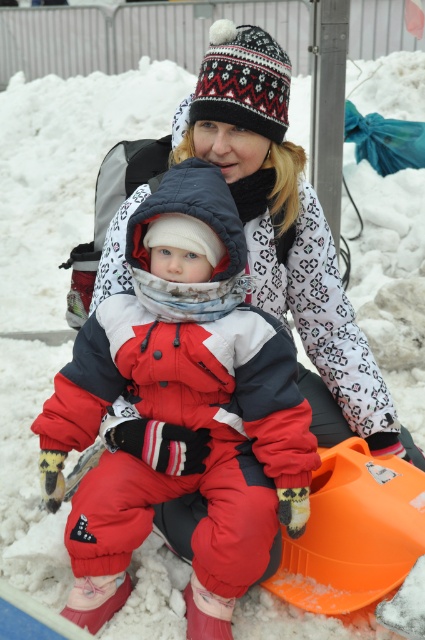
Question: Which point appears farthest from the camera in this image?

Choices:
 (A) (280, 145)
 (B) (187, 193)

Answer: (A)

Question: Does red fleece snowsuit at center have a lesser width compared to white knit hat at upper center?

Choices:
 (A) yes
 (B) no

Answer: (A)

Question: Is red fleece snowsuit at center bigger than white knit hat at upper center?

Choices:
 (A) yes
 (B) no

Answer: (B)

Question: Which of the following is the closest to the observer?

Choices:
 (A) red fleece snowsuit at center
 (B) white knit hat at upper center

Answer: (A)

Question: Can you confirm if red fleece snowsuit at center is positioned below white knit hat at upper center?

Choices:
 (A) no
 (B) yes

Answer: (B)